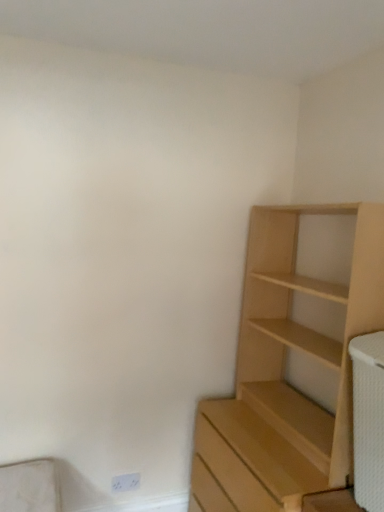
What is the approximate width of light wood shelf at right?

22.18 inches.

The height and width of the screenshot is (512, 384). Find the location of `light wood shelf at right`. light wood shelf at right is located at coordinates (284, 372).

Image resolution: width=384 pixels, height=512 pixels. Describe the element at coordinates (284, 372) in the screenshot. I see `light wood shelf at right` at that location.

The height and width of the screenshot is (512, 384). I want to click on light wood shelf at right, so click(x=284, y=372).